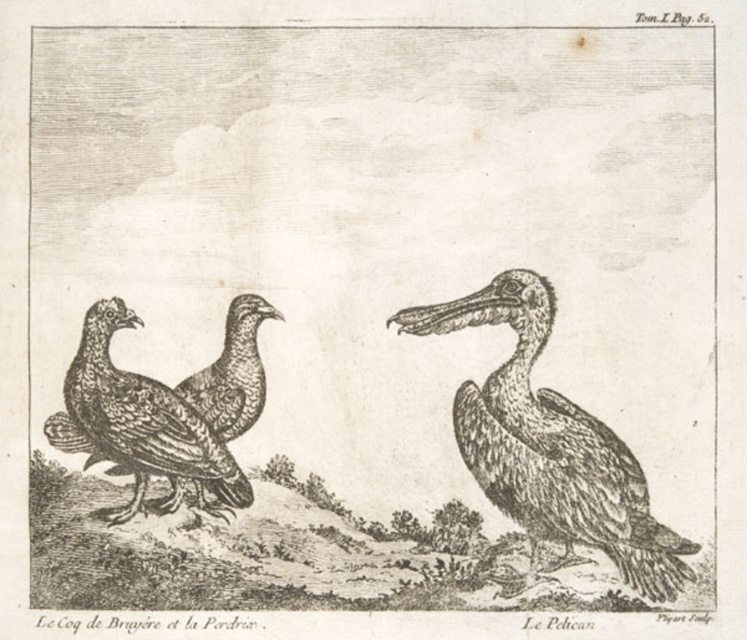
Based on the description provided, which object is larger in size between the gray textured pelican at center and the smooth gray beak at center right?

The gray textured pelican at center is bigger than the smooth gray beak at center right according to the description.